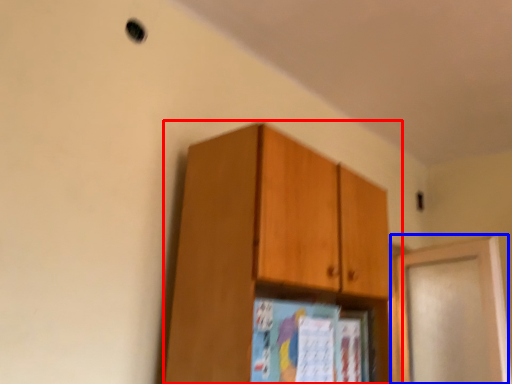
Question: Which object appears farthest to the camera in this image, cabinetry (highlighted by a red box) or door (highlighted by a blue box)?

Choices:
 (A) cabinetry
 (B) door

Answer: (B)